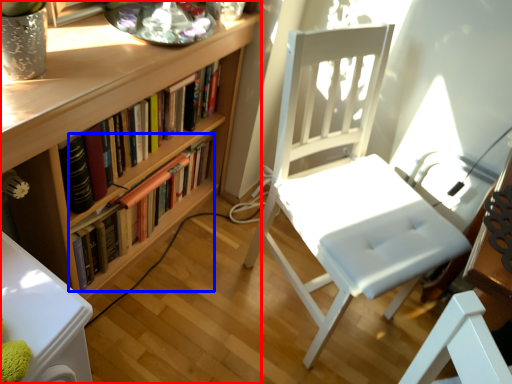
Question: Which of the following is the closest to the observer, bookcase (highlighted by a red box) or book (highlighted by a blue box)?

Choices:
 (A) bookcase
 (B) book

Answer: (A)